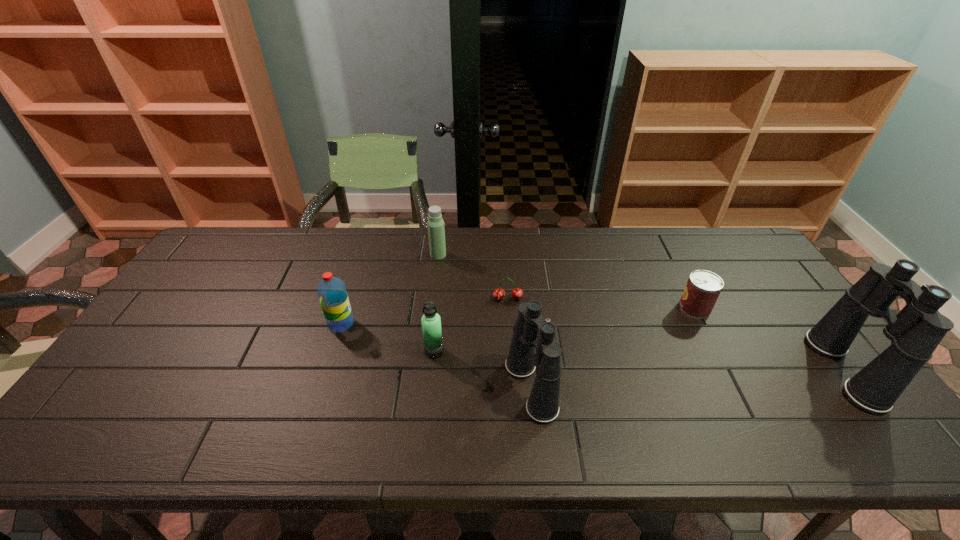
Where is `vacant area that satisfies the following two spatial constraints: 1. on the front label of the leftmost object; 2. on the left side of the nearer thermos bottle`? The width and height of the screenshot is (960, 540). vacant area that satisfies the following two spatial constraints: 1. on the front label of the leftmost object; 2. on the left side of the nearer thermos bottle is located at coordinates (332, 352).

Where is `free space that satisfies the following two spatial constraints: 1. with stems pointing upwards on the shortest object; 2. on the left side of the can`? free space that satisfies the following two spatial constraints: 1. with stems pointing upwards on the shortest object; 2. on the left side of the can is located at coordinates (509, 308).